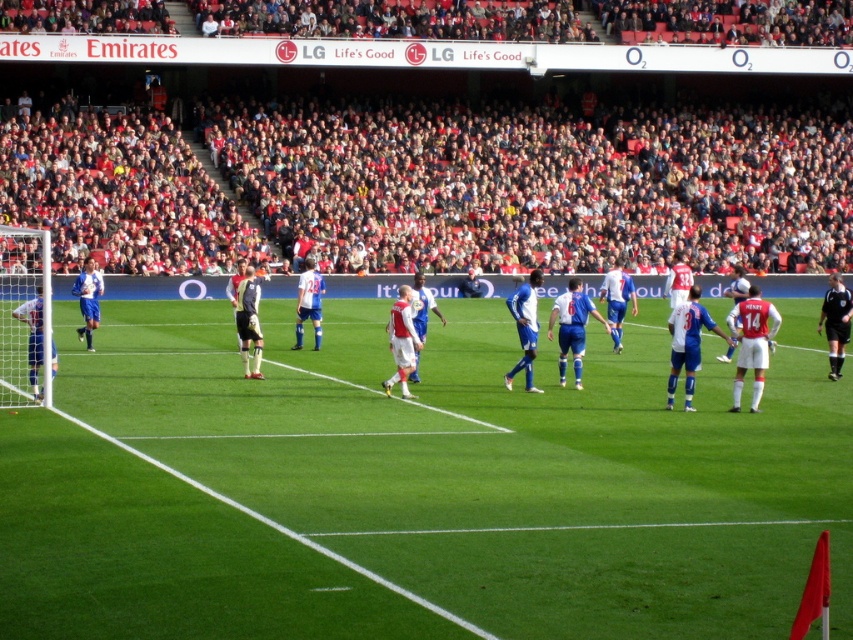
Question: Does white matte soccer ball at center come in front of black uniform at right?

Choices:
 (A) no
 (B) yes

Answer: (B)

Question: Among these objects, which one is nearest to the camera?

Choices:
 (A) blue jersey at center
 (B) blue jersey at left
 (C) green grass field at center

Answer: (C)

Question: Which point is farther from the camera taking this photo?

Choices:
 (A) (518, 296)
 (B) (247, 289)
 (C) (303, 307)

Answer: (C)

Question: Which point is closer to the camera taking this photo?

Choices:
 (A) (254, 348)
 (B) (526, 340)
 (C) (259, 189)

Answer: (B)

Question: Can you confirm if white matte soccer ball at center is positioned to the left of blue jersey at left?

Choices:
 (A) yes
 (B) no

Answer: (B)

Question: Does white matte soccer ball at center appear under blue jersey at left?

Choices:
 (A) no
 (B) yes

Answer: (A)